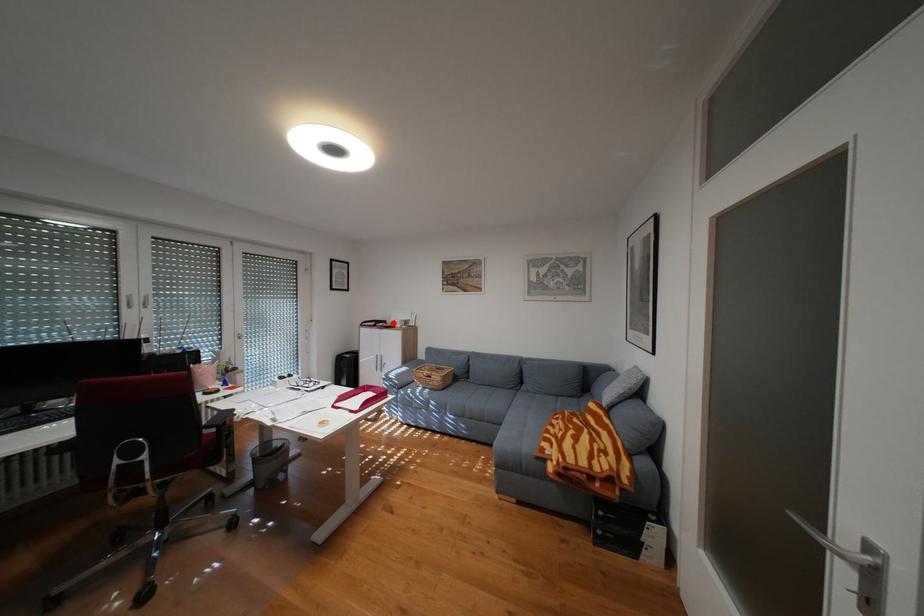
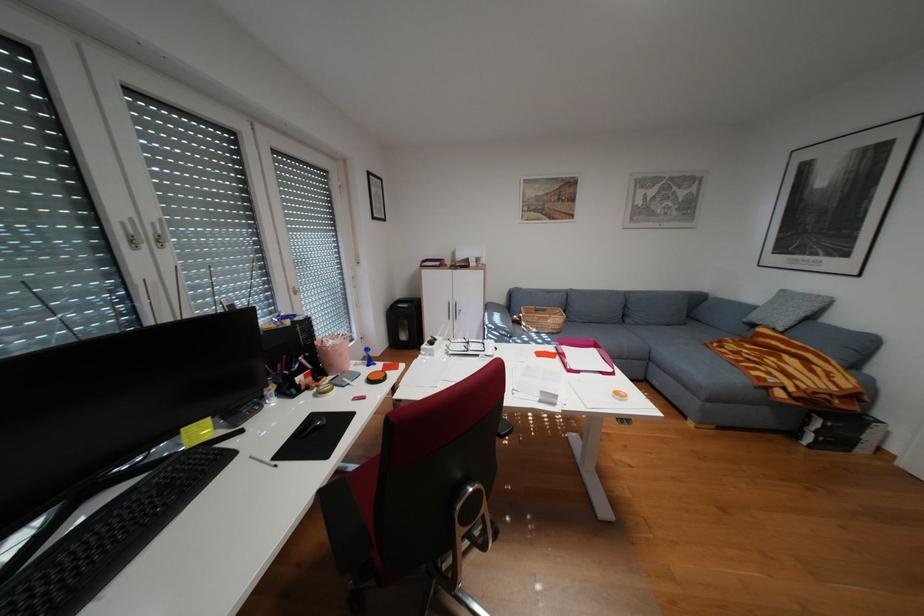
Find the pixel in the second image that matches the highlighted location in the first image.

(460, 262)